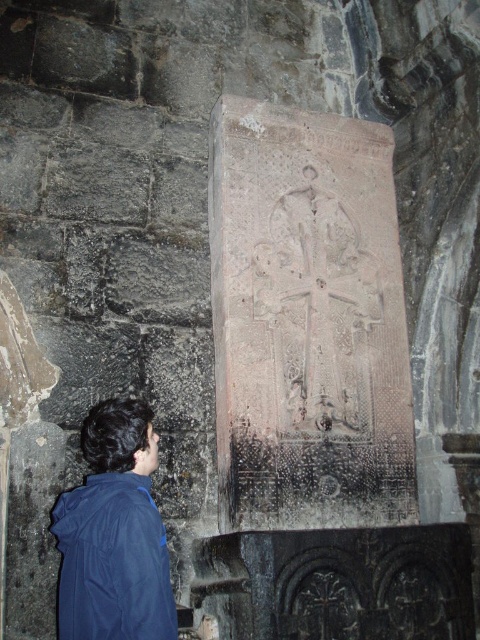
Question: Which object appears closest to the camera in this image?

Choices:
 (A) gray stone carving at center
 (B) blue matte jacket at lower left

Answer: (B)

Question: Is gray stone carving at center bigger than blue matte jacket at lower left?

Choices:
 (A) no
 (B) yes

Answer: (A)

Question: Does gray stone carving at center appear on the right side of blue matte jacket at lower left?

Choices:
 (A) no
 (B) yes

Answer: (B)

Question: Is gray stone carving at center thinner than blue matte jacket at lower left?

Choices:
 (A) yes
 (B) no

Answer: (A)